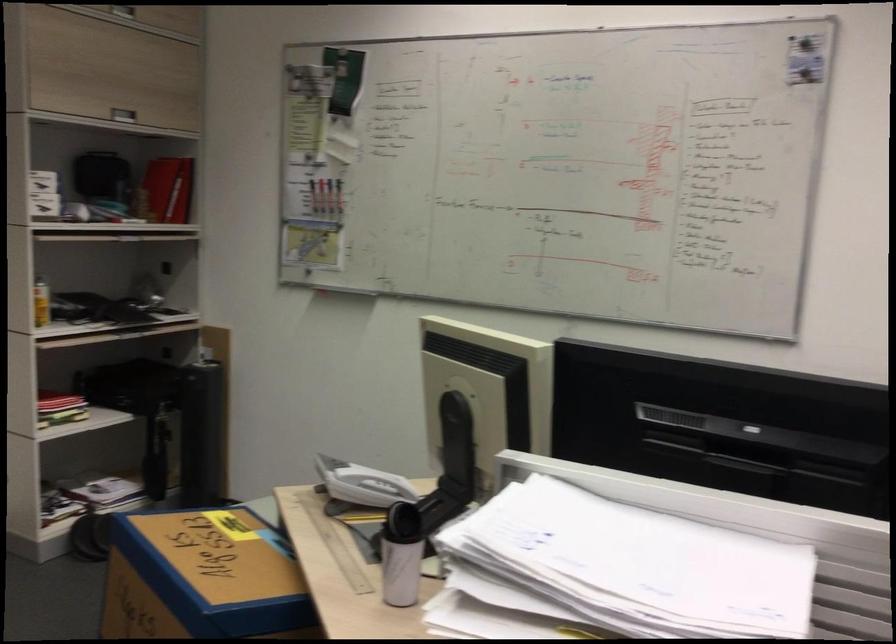
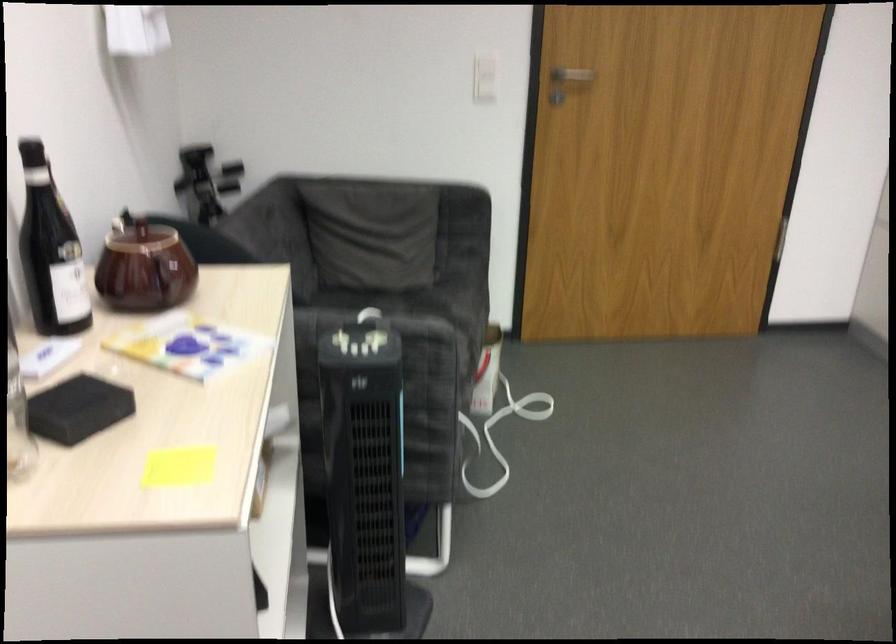
Consider the image. The first image is from the beginning of the video and the second image is from the end. How did the camera likely rotate when shooting the video?

The rotation direction of the camera is left-down.